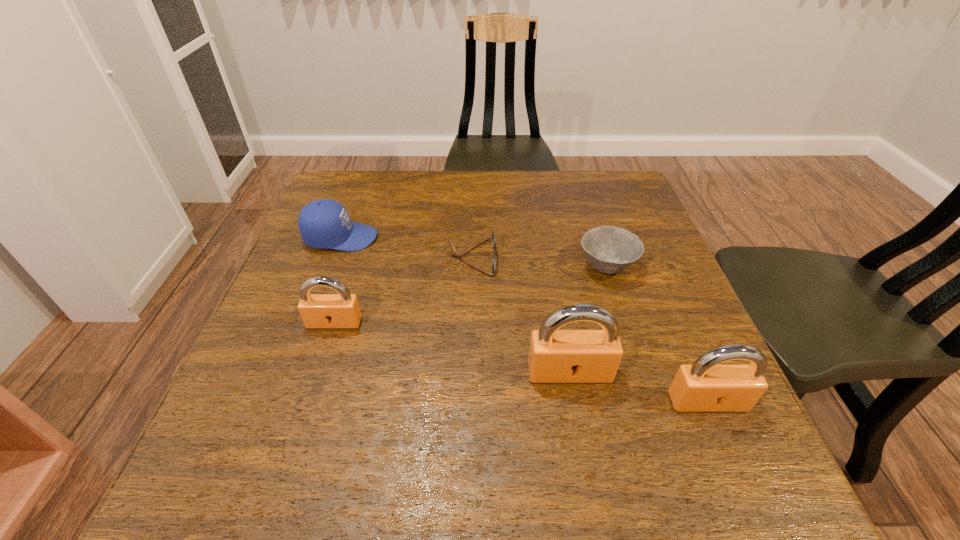
Image resolution: width=960 pixels, height=540 pixels. Identify the location of free spot located to unlock the leftmost padlock from the front. (306, 410).

Where is `vacant space situated on the front-facing side of the third shortest object`? vacant space situated on the front-facing side of the third shortest object is located at coordinates (533, 238).

Locate an element on the screen. The image size is (960, 540). free space located on the front-facing side of the fourth object from right to left is located at coordinates (540, 258).

At what (x,y) coordinates should I click in order to perform the action: click on free space located on the front of the bowl. Please return your answer as a coordinate pair (x, y). Looking at the image, I should click on (653, 413).

At what (x,y) coordinates should I click in order to perform the action: click on object that is at the near edge. Please return your answer as a coordinate pair (x, y). Looking at the image, I should click on (706, 385).

Find the location of `padlock present at the left edge`. padlock present at the left edge is located at coordinates (341, 310).

Find the location of `cap that is at the left edge`. cap that is at the left edge is located at coordinates (323, 224).

What are the coordinates of `padlock located in the right edge section of the desktop` in the screenshot? It's located at point(706,385).

What are the coordinates of `bowl that is positioned at the right edge` in the screenshot? It's located at (609, 249).

I want to click on object that is positioned at the near right corner, so click(706, 385).